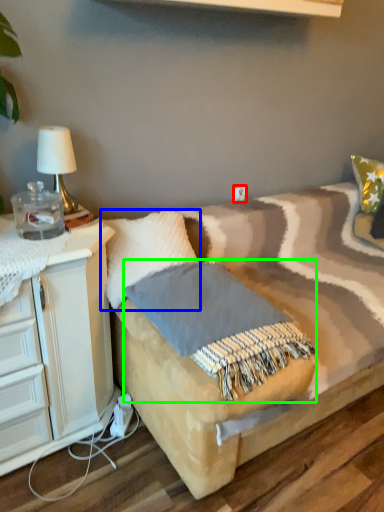
Question: Which object is positioned closest to electric outlet (highlighted by a red box)? Select from pillow (highlighted by a blue box) and blanket (highlighted by a green box).

Choices:
 (A) pillow
 (B) blanket

Answer: (A)